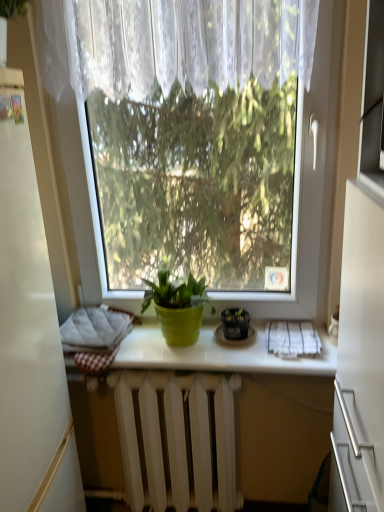
Identify the location of vacant area to the left of white textured cloth at lower right. (248, 353).